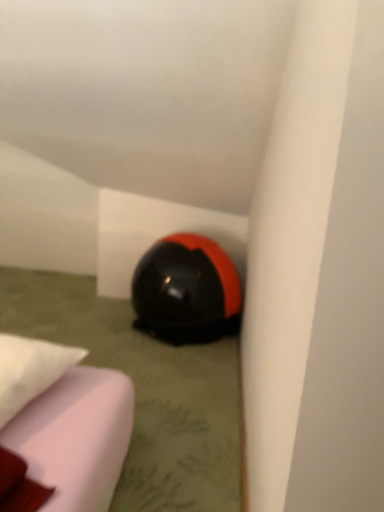
Question: From the image's perspective, relative to black glossy helmet at lower center, is white fabric pillow at lower left above or below?

Choices:
 (A) above
 (B) below

Answer: (B)

Question: From a real-world perspective, relative to black glossy helmet at lower center, is white fabric pillow at lower left vertically above or below?

Choices:
 (A) below
 (B) above

Answer: (B)

Question: Is white fabric pillow at lower left taller or shorter than black glossy helmet at lower center?

Choices:
 (A) short
 (B) tall

Answer: (A)

Question: Looking at the image, does black glossy helmet at lower center seem bigger or smaller compared to white fabric pillow at lower left?

Choices:
 (A) big
 (B) small

Answer: (A)

Question: From a real-world perspective, is black glossy helmet at lower center physically located above or below white fabric pillow at lower left?

Choices:
 (A) below
 (B) above

Answer: (A)

Question: In terms of width, does black glossy helmet at lower center look wider or thinner when compared to white fabric pillow at lower left?

Choices:
 (A) wide
 (B) thin

Answer: (A)

Question: Is black glossy helmet at lower center inside the boundaries of white fabric pillow at lower left, or outside?

Choices:
 (A) outside
 (B) inside

Answer: (A)